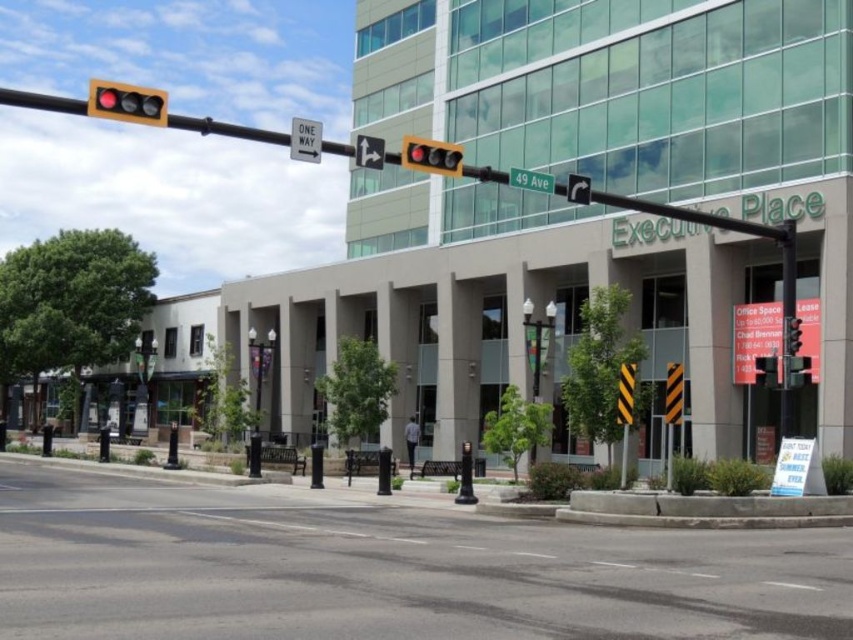
Question: Estimate the real-world distances between objects in this image. Which object is farther from the matte black traffic light at upper left?

Choices:
 (A) black asphalt road at center
 (B) matte black traffic light at upper center
 (C) green matte street sign at upper center

Answer: (C)

Question: Is green matte street sign at upper center below metallic traffic light at right?

Choices:
 (A) yes
 (B) no

Answer: (B)

Question: Is matte black traffic light at upper center above white plastic one-way sign at upper center?

Choices:
 (A) yes
 (B) no

Answer: (A)

Question: Estimate the real-world distances between objects in this image. Which object is farther from the metallic traffic light at right?

Choices:
 (A) green matte street sign at upper center
 (B) matte black traffic light at upper left

Answer: (B)

Question: Can you confirm if matte black traffic light at upper center is smaller than white plastic one-way sign at upper center?

Choices:
 (A) no
 (B) yes

Answer: (A)

Question: Which of the following is the closest to the observer?

Choices:
 (A) matte black traffic light at upper left
 (B) black asphalt road at center
 (C) metallic traffic light at right
 (D) matte black traffic light at upper center

Answer: (B)